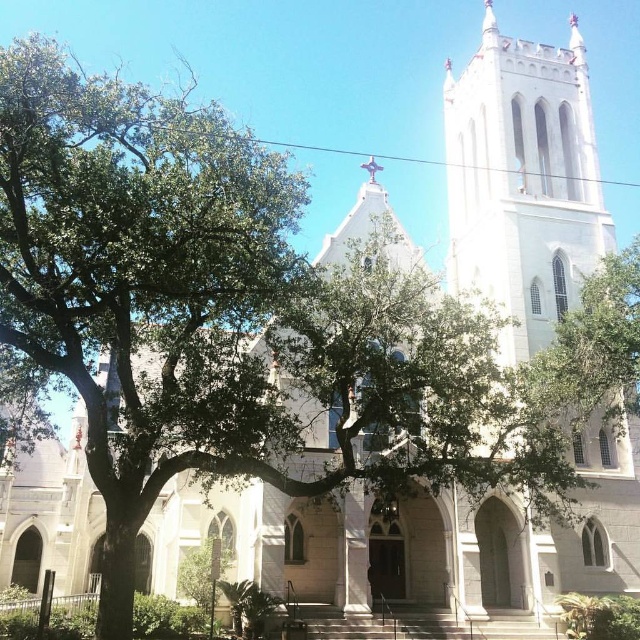
Consider the image. You are a photographer planning to capture the church and the tree in a single shot. Given that the white stone tower at upper right and the green leafy tree at upper right are both in the upper right corner, which one should you focus on to ensure both are fully visible in the frame?

The white stone tower at upper right has a larger width than the green leafy tree at upper right, so focusing on the tower will help ensure both are fully visible in the frame.

Based on the photo, you are standing at the point marked as point (522,180) in the image. What object is located at this point?

The white stone tower at upper right is located at point (522,180).

You are a drone operator who needs to fly a drone between the white stone tower at upper right and the green leafy tree at upper right. The drone has a maximum flight distance of 10 meters. Can the drone safely navigate between them without exceeding its range?

The white stone tower at upper right is 10.80 meters from the green leafy tree at upper right. Since the drone can only fly up to 10 meters, it cannot safely navigate between them without exceeding its range.